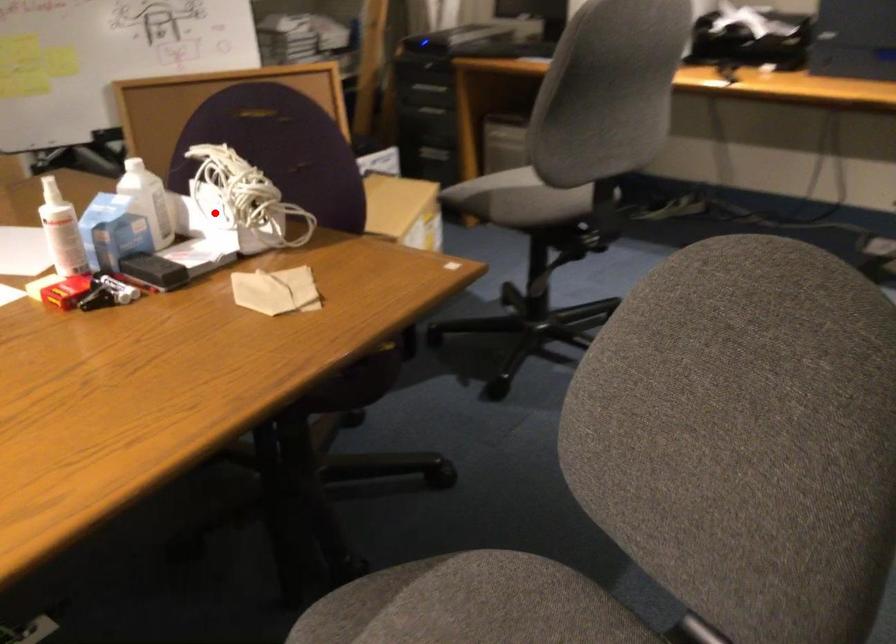
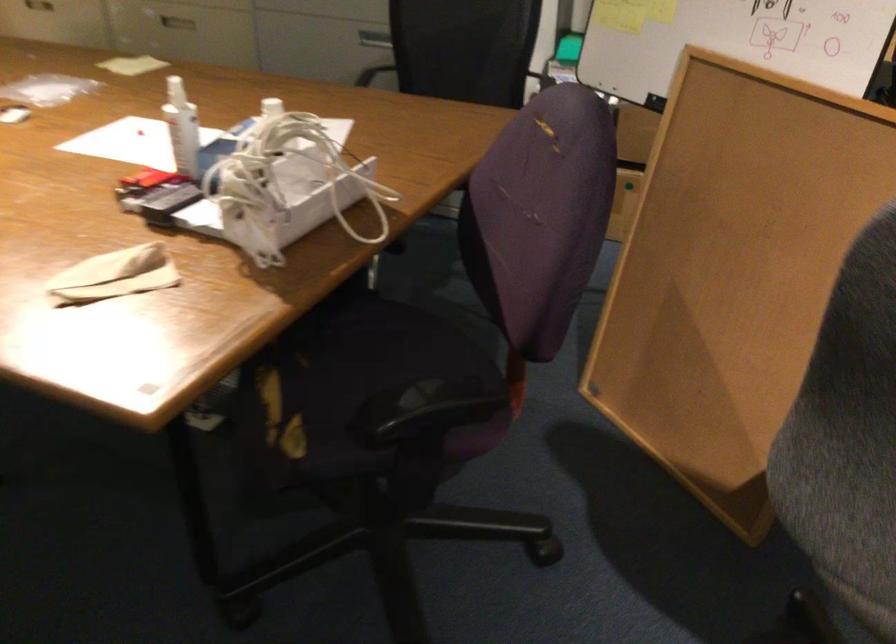
Find the pixel in the second image that matches the highlighted location in the first image.

(291, 190)